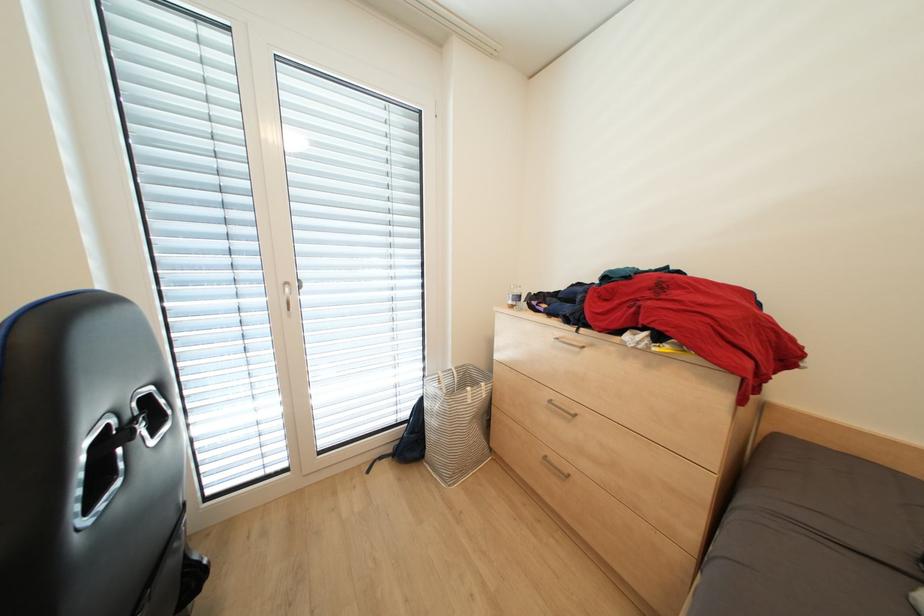
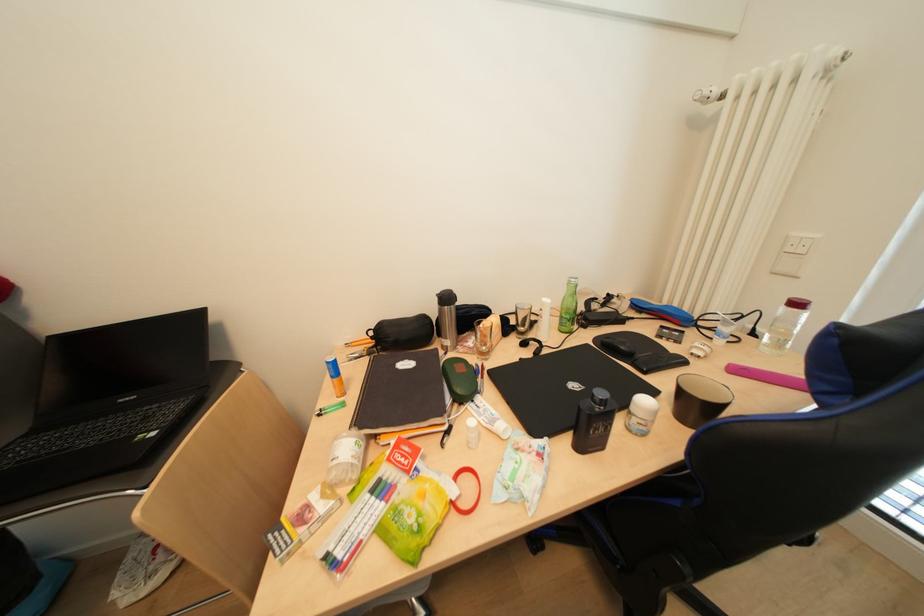
Based on the continuous images, in which direction is the camera rotating?

The camera's rotation is toward left-down.